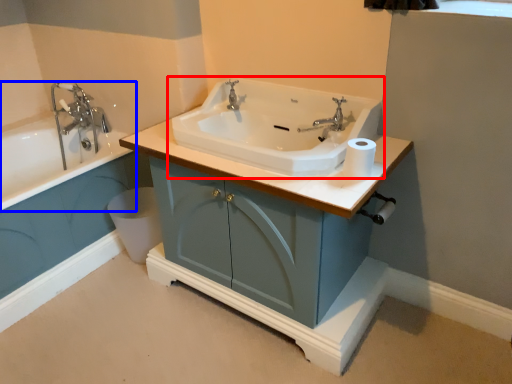
Question: Which object is closer to the camera taking this photo, sink (highlighted by a red box) or bathtub (highlighted by a blue box)?

Choices:
 (A) sink
 (B) bathtub

Answer: (A)